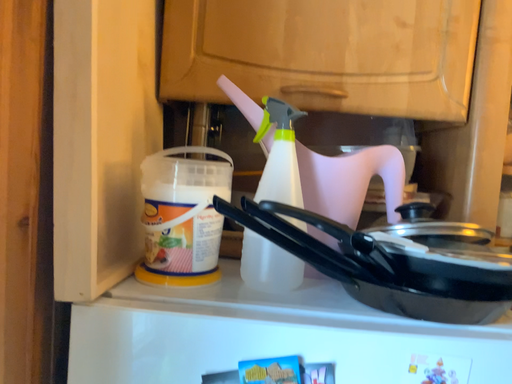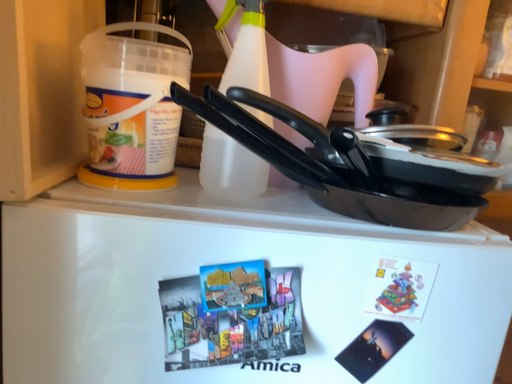
Question: How did the camera likely rotate when shooting the video?

Choices:
 (A) rotated downward
 (B) rotated upward

Answer: (A)